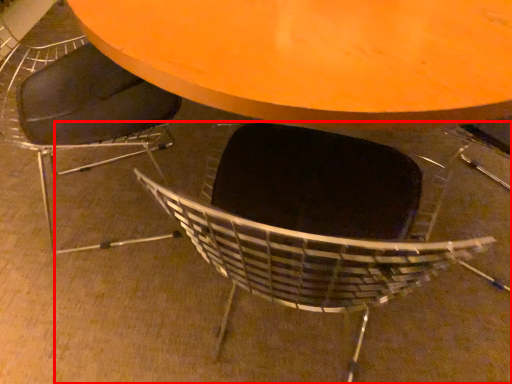
Question: From the image's perspective, where is chair (annotated by the red box) located in relation to chair in the image?

Choices:
 (A) above
 (B) below

Answer: (B)